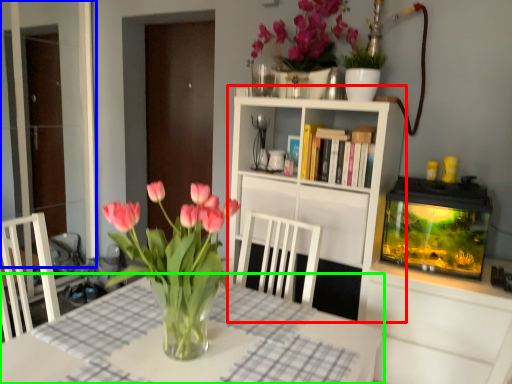
Question: Which is farther away from cabinetry (highlighted by a red box)? glass door (highlighted by a blue box) or table (highlighted by a green box)?

Choices:
 (A) glass door
 (B) table

Answer: (A)